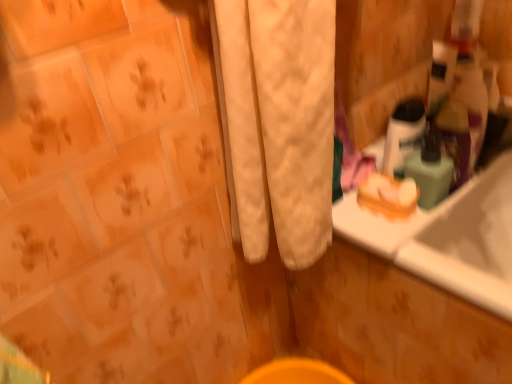
Question: Is translucent plastic mouthwash at upper right, arranged as the second mouthwash when viewed from the right, bigger than green matte bottle at upper right, marked as the first mouthwash in a right-to-left arrangement?

Choices:
 (A) yes
 (B) no

Answer: (A)

Question: Is translucent plastic mouthwash at upper right, arranged as the second mouthwash when viewed from the right, smaller than green matte bottle at upper right, marked as the first mouthwash in a right-to-left arrangement?

Choices:
 (A) yes
 (B) no

Answer: (B)

Question: Would you say translucent plastic mouthwash at upper right, arranged as the second mouthwash when viewed from the right, contains green matte bottle at upper right, marked as the first mouthwash in a right-to-left arrangement?

Choices:
 (A) no
 (B) yes

Answer: (A)

Question: Considering the relative sizes of translucent plastic mouthwash at upper right, the 1th mouthwash from the left, and green matte bottle at upper right, marked as the first mouthwash in a right-to-left arrangement, in the image provided, is translucent plastic mouthwash at upper right, the 1th mouthwash from the left, taller than green matte bottle at upper right, marked as the first mouthwash in a right-to-left arrangement,?

Choices:
 (A) no
 (B) yes

Answer: (B)

Question: Is translucent plastic mouthwash at upper right, the 1th mouthwash from the left, positioned before green matte bottle at upper right, the 2th mouthwash in the left-to-right sequence?

Choices:
 (A) yes
 (B) no

Answer: (B)

Question: Is translucent plastic mouthwash at upper right, the 1th mouthwash from the left, oriented away from green matte bottle at upper right, the 2th mouthwash in the left-to-right sequence?

Choices:
 (A) yes
 (B) no

Answer: (A)

Question: Can you confirm if green matte bottle at upper right, the 2th mouthwash in the left-to-right sequence, is taller than orange matte soap at right?

Choices:
 (A) no
 (B) yes

Answer: (B)

Question: Is green matte bottle at upper right, marked as the first mouthwash in a right-to-left arrangement, oriented towards orange matte soap at right?

Choices:
 (A) no
 (B) yes

Answer: (A)

Question: From the image's perspective, is green matte bottle at upper right, marked as the first mouthwash in a right-to-left arrangement, beneath orange matte soap at right?

Choices:
 (A) yes
 (B) no

Answer: (B)

Question: Is green matte bottle at upper right, marked as the first mouthwash in a right-to-left arrangement, to the right of orange matte soap at right from the viewer's perspective?

Choices:
 (A) yes
 (B) no

Answer: (A)

Question: Does green matte bottle at upper right, the 2th mouthwash in the left-to-right sequence, have a larger size compared to orange matte soap at right?

Choices:
 (A) yes
 (B) no

Answer: (A)

Question: Does green matte bottle at upper right, the 2th mouthwash in the left-to-right sequence, have a smaller size compared to orange matte soap at right?

Choices:
 (A) yes
 (B) no

Answer: (B)

Question: Is orange matte soap at right bigger than green matte bottle at upper right, marked as the first mouthwash in a right-to-left arrangement?

Choices:
 (A) yes
 (B) no

Answer: (B)